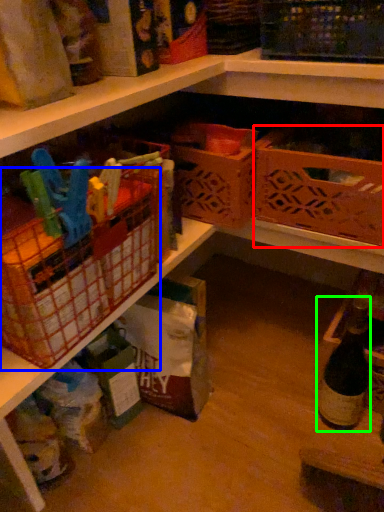
Question: Which is nearer to the basket (highlighted by a red box)? basket (highlighted by a blue box) or bottle (highlighted by a green box).

Choices:
 (A) basket
 (B) bottle

Answer: (B)